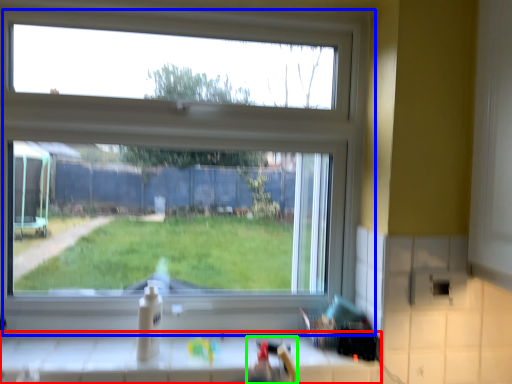
Question: Which object is the closest to the counter (highlighted by a red box)? Choose among these: window (highlighted by a blue box) or sink (highlighted by a green box).

Choices:
 (A) window
 (B) sink

Answer: (B)